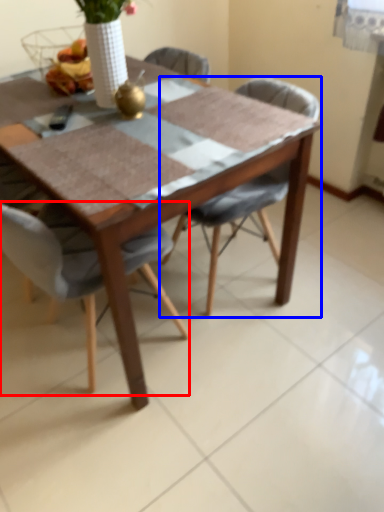
Question: Which object is closer to the camera taking this photo, chair (highlighted by a red box) or chair (highlighted by a blue box)?

Choices:
 (A) chair
 (B) chair

Answer: (A)